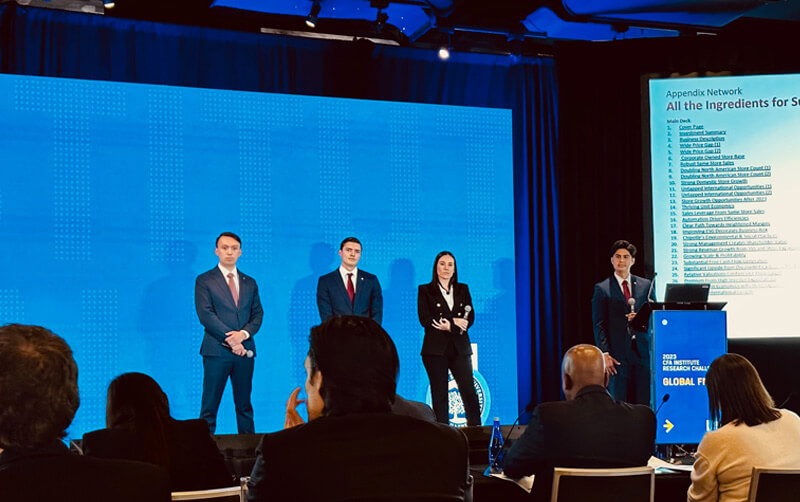
This screenshot has width=800, height=502. What are the coordinates of `screen` in the screenshot? It's located at coord(769,142), coord(326,153).